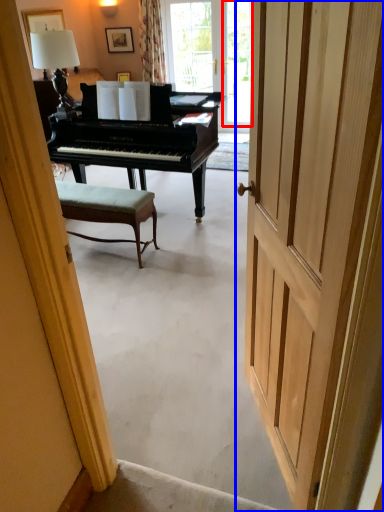
Question: Which point is further to the camera, window screen (highlighted by a red box) or door (highlighted by a blue box)?

Choices:
 (A) window screen
 (B) door

Answer: (A)